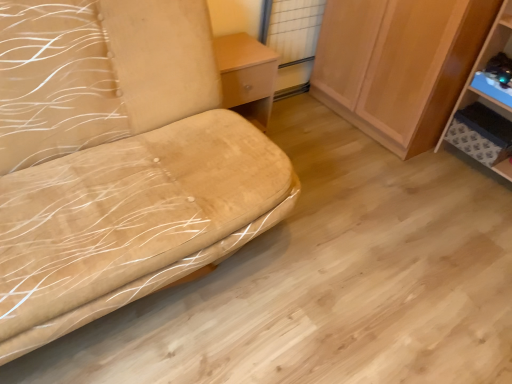
I want to click on light wood/texture table at center, so click(x=247, y=76).

Describe the element at coordinates (398, 65) in the screenshot. The image size is (512, 384). I see `wooden cabinet at right` at that location.

Identify the location of blue plastic shelf at right. (485, 107).

From a real-world perspective, does suede-like beige sofa at left stand above light wood/texture table at center?

Yes, from a real-world perspective, suede-like beige sofa at left is over light wood/texture table at center

Does suede-like beige sofa at left come in front of light wood/texture table at center?

Yes, suede-like beige sofa at left is in front of light wood/texture table at center.

Is suede-like beige sofa at left far from light wood/texture table at center?

No, suede-like beige sofa at left is in close proximity to light wood/texture table at center.

Does suede-like beige sofa at left have a lesser width compared to light wood/texture table at center?

No, suede-like beige sofa at left is not thinner than light wood/texture table at center.

Is suede-like beige sofa at left positioned beyond the bounds of blue plastic shelf at right?

suede-like beige sofa at left is positioned outside blue plastic shelf at right.

Which point is more distant from viewer, (22, 151) or (500, 122)?

The point (500, 122) is behind.

How many degrees apart are the facing directions of suede-like beige sofa at left and blue plastic shelf at right?

The facing directions of suede-like beige sofa at left and blue plastic shelf at right are 90.7 degrees apart.

From a real-world perspective, which object stands above the other?

suede-like beige sofa at left.

From a real-world perspective, who is located higher, light wood/texture table at center or suede-like beige sofa at left?

suede-like beige sofa at left, from a real-world perspective.

Is light wood/texture table at center oriented towards suede-like beige sofa at left?

No, light wood/texture table at center is not turned towards suede-like beige sofa at left.

From the image's perspective, is light wood/texture table at center above or below suede-like beige sofa at left?

Clearly, from the image's perspective, light wood/texture table at center is above suede-like beige sofa at left.

Can you confirm if light wood/texture table at center is bigger than suede-like beige sofa at left?

Actually, light wood/texture table at center might be smaller than suede-like beige sofa at left.

Is suede-like beige sofa at left looking in the opposite direction of wooden cabinet at right?

No, wooden cabinet at right is not at the back of suede-like beige sofa at left.

From the image's perspective, is suede-like beige sofa at left below wooden cabinet at right?

Yes, from the image's perspective, suede-like beige sofa at left is below wooden cabinet at right.

Does suede-like beige sofa at left have a greater width compared to wooden cabinet at right?

Yes.

This screenshot has width=512, height=384. In the image, there is a wooden cabinet at right. What are the coordinates of `furniture below it (from the image's perspective)` in the screenshot? It's located at (117, 161).

Which is in front, wooden cabinet at right or light wood/texture table at center?

Positioned in front is wooden cabinet at right.

Considering the sizes of objects wooden cabinet at right and light wood/texture table at center in the image provided, who is taller, wooden cabinet at right or light wood/texture table at center?

wooden cabinet at right is taller.

Does wooden cabinet at right have a greater width compared to light wood/texture table at center?

Correct, the width of wooden cabinet at right exceeds that of light wood/texture table at center.

From the image's perspective, is wooden cabinet at right located beneath light wood/texture table at center?

No, from the image's perspective, wooden cabinet at right is not beneath light wood/texture table at center.

Where is `cabinetry on the right of the suede-like beige sofa at left`? The image size is (512, 384). cabinetry on the right of the suede-like beige sofa at left is located at coordinates (398, 65).

Considering the sizes of objects wooden cabinet at right and suede-like beige sofa at left in the image provided, who is smaller, wooden cabinet at right or suede-like beige sofa at left?

Smaller between the two is wooden cabinet at right.

Which is behind, point (400, 61) or point (139, 104)?

The point (400, 61) is farther from the camera.

How different are the orientations of wooden cabinet at right and suede-like beige sofa at left in degrees?

90.7 degrees separate the facing orientations of wooden cabinet at right and suede-like beige sofa at left.

What's the angular difference between blue plastic shelf at right and suede-like beige sofa at left's facing directions?

They differ by 90.7 degrees in their facing directions.

Considering the sizes of objects blue plastic shelf at right and suede-like beige sofa at left in the image provided, who is wider, blue plastic shelf at right or suede-like beige sofa at left?

suede-like beige sofa at left is wider.

Is point (488, 81) closer to viewer compared to point (173, 215)?

No, (488, 81) is behind (173, 215).

Locate an element on the screen. The height and width of the screenshot is (384, 512). furniture in front of the light wood/texture table at center is located at coordinates (117, 161).

At what (x,y) coordinates should I click in order to perform the action: click on furniture that appears on the left of blue plastic shelf at right. Please return your answer as a coordinate pair (x, y). Looking at the image, I should click on (117, 161).

When comparing their distances from blue plastic shelf at right, does suede-like beige sofa at left or light wood/texture table at center seem closer?

light wood/texture table at center is positioned closer to the anchor blue plastic shelf at right.

Estimate the real-world distances between objects in this image. Which object is further from light wood/texture table at center, blue plastic shelf at right or wooden cabinet at right?

The object further to light wood/texture table at center is blue plastic shelf at right.

Estimate the real-world distances between objects in this image. Which object is further from suede-like beige sofa at left, light wood/texture table at center or blue plastic shelf at right?

blue plastic shelf at right.

From the image, which object appears to be farther from blue plastic shelf at right, light wood/texture table at center or wooden cabinet at right?

The object further to blue plastic shelf at right is light wood/texture table at center.

Based on their spatial positions, is blue plastic shelf at right or wooden cabinet at right further from suede-like beige sofa at left?

blue plastic shelf at right is positioned further to the anchor suede-like beige sofa at left.

Based on their spatial positions, is wooden cabinet at right or suede-like beige sofa at left further from blue plastic shelf at right?

suede-like beige sofa at left is further to blue plastic shelf at right.

When comparing their distances from suede-like beige sofa at left, does blue plastic shelf at right or light wood/texture table at center seem closer?

Among the two, light wood/texture table at center is located nearer to suede-like beige sofa at left.

Based on the photo, which object lies further to the anchor point wooden cabinet at right, suede-like beige sofa at left or light wood/texture table at center?

suede-like beige sofa at left.

The height and width of the screenshot is (384, 512). I want to click on table situated between suede-like beige sofa at left and blue plastic shelf at right from left to right, so click(247, 76).

This screenshot has width=512, height=384. In order to click on cabinetry between suede-like beige sofa at left and blue plastic shelf at right in the horizontal direction in this screenshot , I will do `click(398, 65)`.

The image size is (512, 384). Find the location of `cabinetry between suede-like beige sofa at left and light wood/texture table at center from front to back`. cabinetry between suede-like beige sofa at left and light wood/texture table at center from front to back is located at coordinates (398, 65).

The image size is (512, 384). Find the location of `cabinetry between light wood/texture table at center and blue plastic shelf at right`. cabinetry between light wood/texture table at center and blue plastic shelf at right is located at coordinates (398, 65).